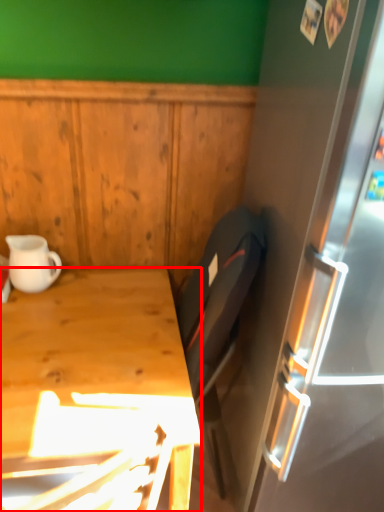
Question: Considering the relative positions of desk (annotated by the red box) and coffee cup in the image provided, where is desk (annotated by the red box) located with respect to the staircase?

Choices:
 (A) left
 (B) right

Answer: (B)